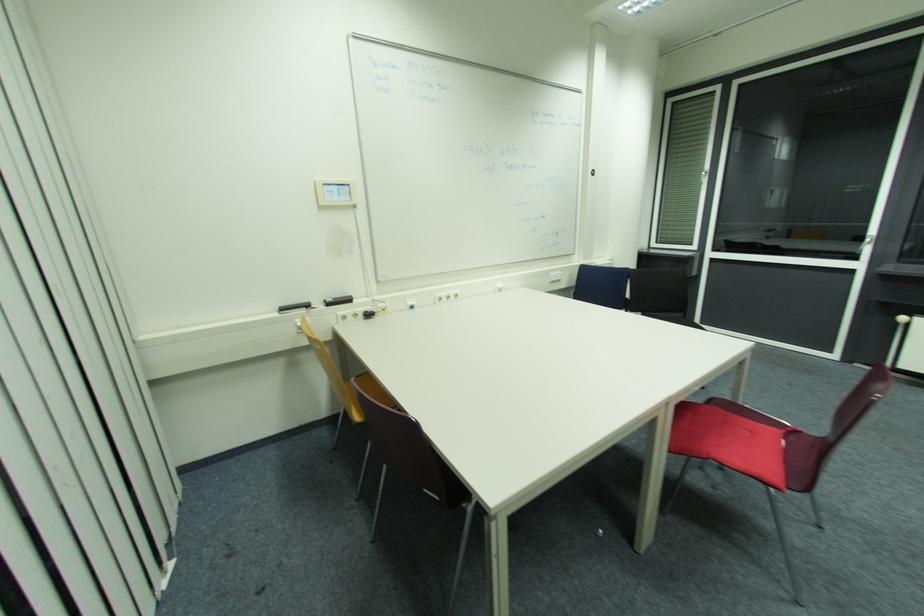
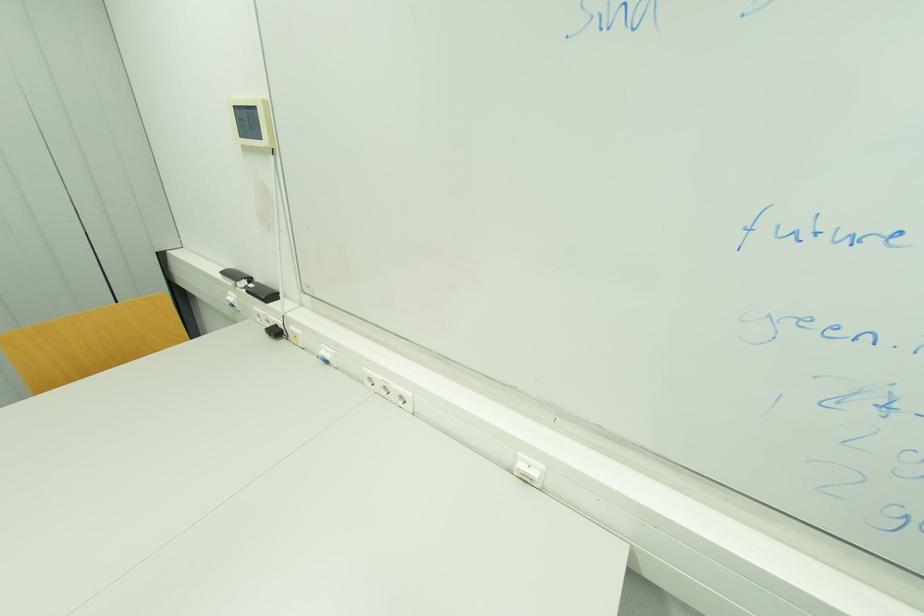
The point at (371, 315) is marked in the first image. Where is the corresponding point in the second image?

(281, 333)